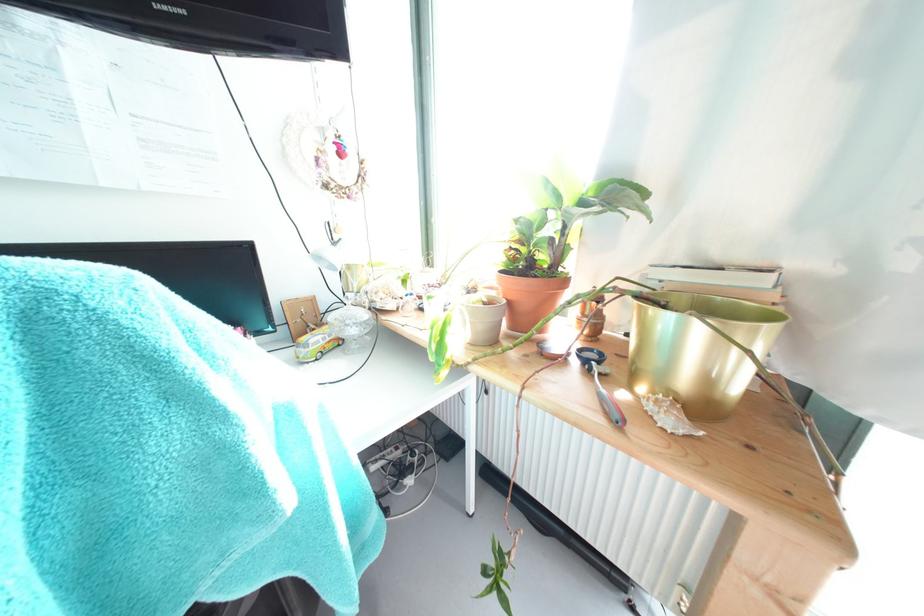
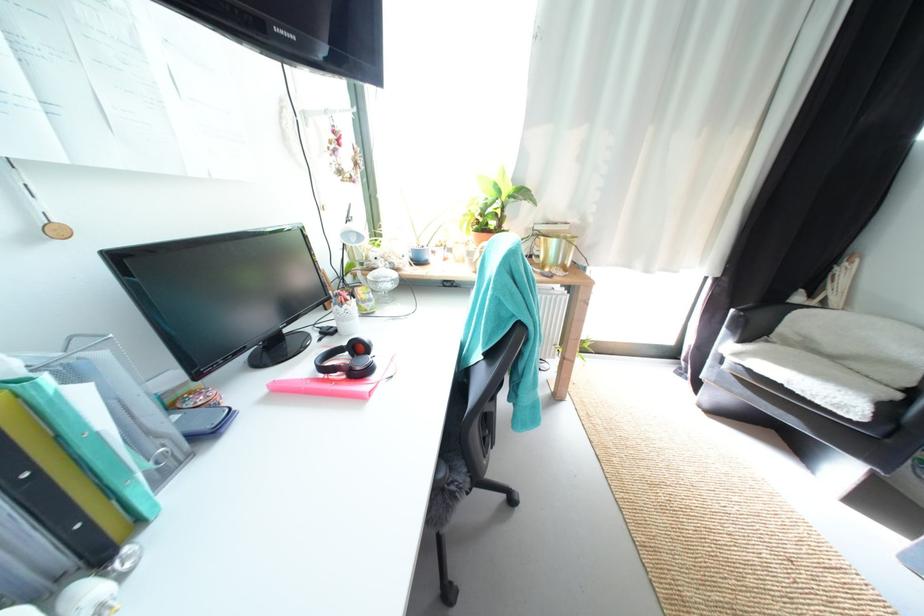
In the second image, find the point that corresponds to [560,241] in the first image.

(505, 216)